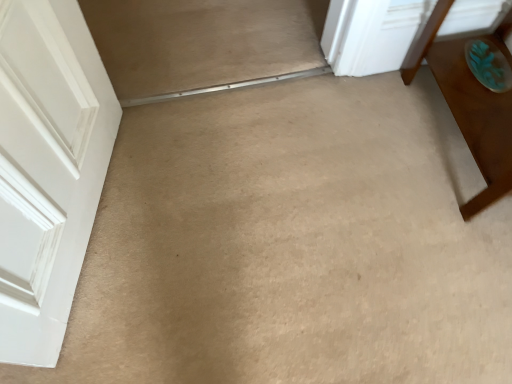
What do you see at coordinates (468, 108) in the screenshot? The height and width of the screenshot is (384, 512). I see `brown wooden table at right` at bounding box center [468, 108].

What is the approximate width of brown wooden table at right?

The width of brown wooden table at right is 15.18 inches.

Identify the location of brown wooden table at right. This screenshot has width=512, height=384. (468, 108).

You are a GUI agent. You are given a task and a screenshot of the screen. Output one action in this format:
    pyautogui.click(x=<x>, y=<y>)
    Task: Click on the brown wooden table at right
    Image resolution: width=512 pixels, height=384 pixels.
    Given the screenshot: What is the action you would take?
    pyautogui.click(x=468, y=108)